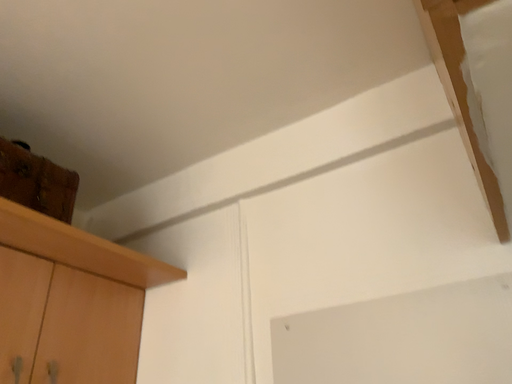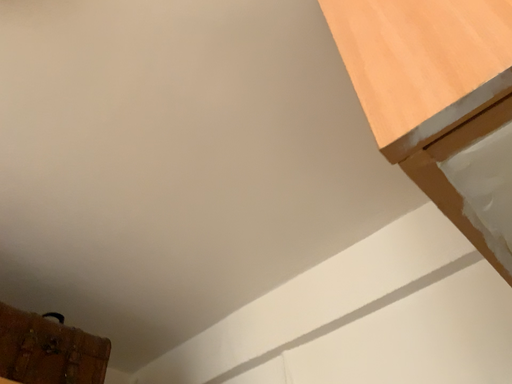
Question: Which way did the camera rotate in the video?

Choices:
 (A) rotated left
 (B) rotated right

Answer: (A)